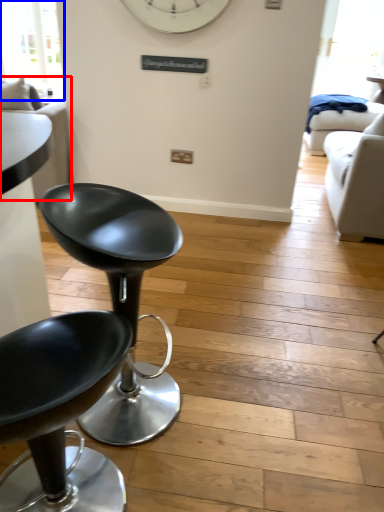
Question: Which of the following is the farthest to the observer, couch (highlighted by a red box) or window screen (highlighted by a blue box)?

Choices:
 (A) couch
 (B) window screen

Answer: (B)